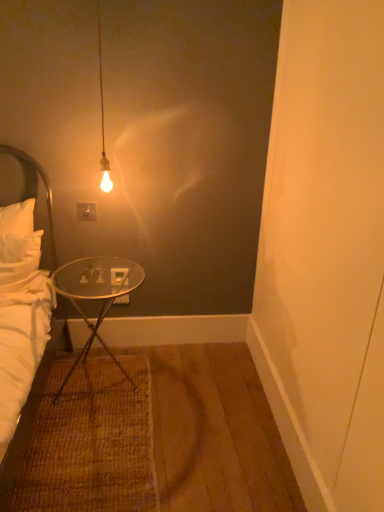
Question: From the image's perspective, relative to white soft bed at left, is white fabric headboard at left above or below?

Choices:
 (A) above
 (B) below

Answer: (A)

Question: From a real-world perspective, relative to white soft bed at left, is white fabric headboard at left vertically above or below?

Choices:
 (A) below
 (B) above

Answer: (B)

Question: Based on their relative distances, which object is farther from the transparent glass table at lower left?

Choices:
 (A) white soft bed at left
 (B) white fabric headboard at left
 (C) white plastic power outlet at upper center

Answer: (C)

Question: Which of these objects is positioned farthest from the white soft bed at left?

Choices:
 (A) transparent glass table at lower left
 (B) white plastic power outlet at upper center
 (C) white fabric headboard at left

Answer: (B)